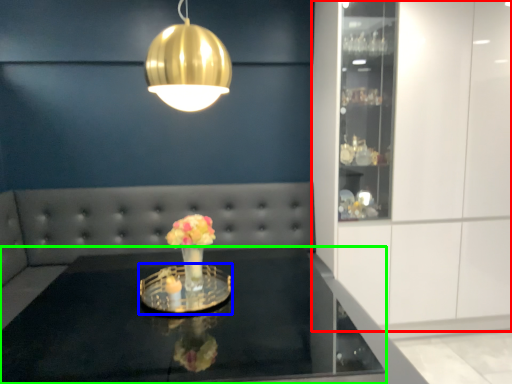
Question: Based on their relative distances, which object is nearer to cabinetry (highlighted by a red box)? Choose from glass plate (highlighted by a blue box) and table (highlighted by a green box).

Choices:
 (A) glass plate
 (B) table

Answer: (B)